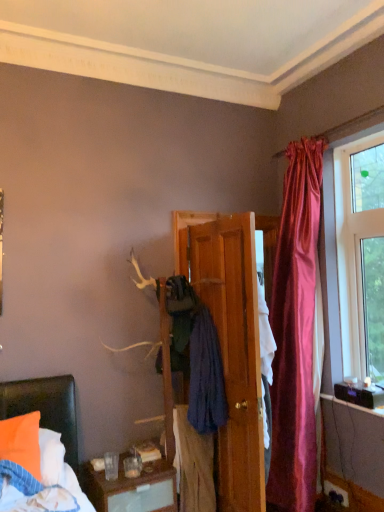
Question: Considering the relative sizes of wooden door at center and blue cotton sweater at center, the 2th clothing in the top-to-bottom sequence, in the image provided, is wooden door at center wider than blue cotton sweater at center, the 2th clothing in the top-to-bottom sequence,?

Choices:
 (A) no
 (B) yes

Answer: (B)

Question: From the image's perspective, is wooden door at center above blue cotton sweater at center, the 2th clothing in the top-to-bottom sequence?

Choices:
 (A) no
 (B) yes

Answer: (B)

Question: From the image's perspective, would you say wooden door at center is shown under blue cotton sweater at center, the 1th clothing positioned from the bottom?

Choices:
 (A) yes
 (B) no

Answer: (B)

Question: Is the depth of wooden door at center greater than that of blue cotton sweater at center, the 1th clothing positioned from the bottom?

Choices:
 (A) no
 (B) yes

Answer: (A)

Question: From a real-world perspective, is wooden door at center below blue cotton sweater at center, the 2th clothing in the top-to-bottom sequence?

Choices:
 (A) no
 (B) yes

Answer: (A)

Question: Considering the relative positions of wooden door at center and blue cotton sweater at center, the 2th clothing in the top-to-bottom sequence, in the image provided, is wooden door at center to the left of blue cotton sweater at center, the 2th clothing in the top-to-bottom sequence, from the viewer's perspective?

Choices:
 (A) yes
 (B) no

Answer: (B)

Question: Is blue cotton towel at center, acting as the 1th clothing starting from the top, closer to the viewer compared to blue cotton sweater at center, the 2th clothing in the top-to-bottom sequence?

Choices:
 (A) yes
 (B) no

Answer: (B)

Question: Could you tell me if blue cotton towel at center, acting as the 1th clothing starting from the top, is facing blue cotton sweater at center, the 2th clothing in the top-to-bottom sequence?

Choices:
 (A) no
 (B) yes

Answer: (A)

Question: Is blue cotton towel at center, acting as the 1th clothing starting from the top, to the right of blue cotton sweater at center, the 2th clothing in the top-to-bottom sequence, from the viewer's perspective?

Choices:
 (A) yes
 (B) no

Answer: (A)

Question: Can you confirm if blue cotton towel at center, acting as the 1th clothing starting from the top, is positioned to the left of blue cotton sweater at center, the 1th clothing positioned from the bottom?

Choices:
 (A) no
 (B) yes

Answer: (A)

Question: Is blue cotton towel at center, acting as the second clothing starting from the bottom, positioned behind blue cotton sweater at center, the 1th clothing positioned from the bottom?

Choices:
 (A) no
 (B) yes

Answer: (B)

Question: From a real-world perspective, is blue cotton towel at center, acting as the second clothing starting from the bottom, located beneath blue cotton sweater at center, the 1th clothing positioned from the bottom?

Choices:
 (A) no
 (B) yes

Answer: (A)

Question: Is wooden door at center taller than clear glass window at upper right?

Choices:
 (A) no
 (B) yes

Answer: (B)